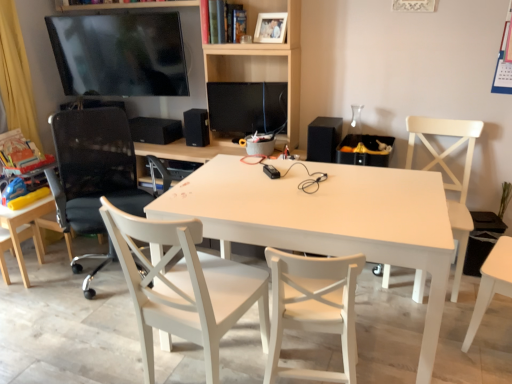
Find the location of a particular element. The height and width of the screenshot is (384, 512). free location to the right of white wood chair at center, which ranks as the second chair in right-to-left order is located at coordinates (394, 357).